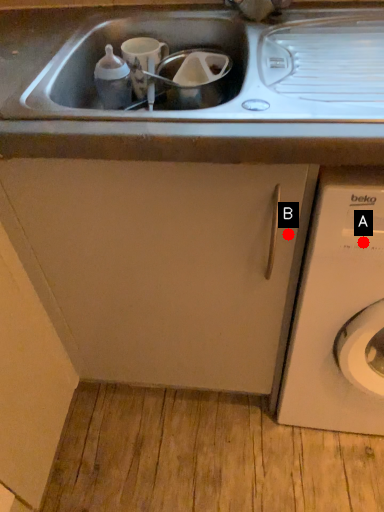
Question: Two points are circled on the image, labeled by A and B beside each circle. Which point is farther to the camera?

Choices:
 (A) A is further
 (B) B is further

Answer: (B)